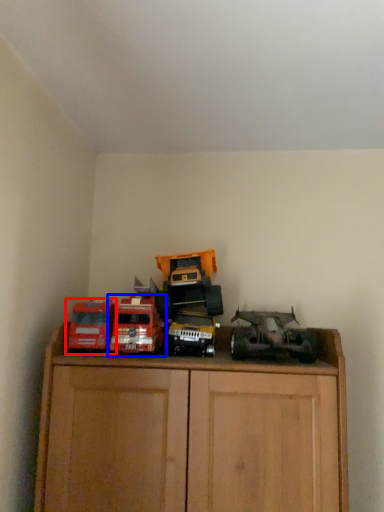
Question: Which object appears closest to the camera in this image, toy (highlighted by a red box) or toy (highlighted by a blue box)?

Choices:
 (A) toy
 (B) toy

Answer: (A)